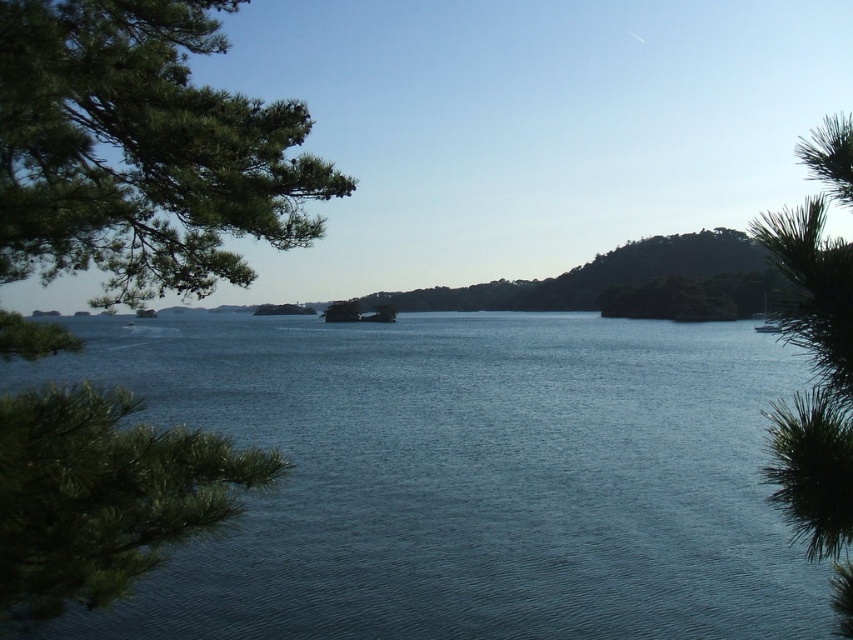
Question: Which object is positioned farthest from the blue water at center?

Choices:
 (A) green needle-like leaves at right
 (B) green matte tree at left
 (C) white glossy boat at center

Answer: (C)

Question: Which of the following is the farthest from the observer?

Choices:
 (A) (810, 448)
 (B) (270, 416)

Answer: (B)

Question: Which of the following is the farthest from the observer?

Choices:
 (A) (763, 470)
 (B) (498, 321)
 (C) (184, 77)

Answer: (B)

Question: Is green needle-like leaves at right above white glossy boat at center?

Choices:
 (A) yes
 (B) no

Answer: (A)

Question: Is green matte tree at left in front of green needle-like leaves at right?

Choices:
 (A) no
 (B) yes

Answer: (A)

Question: Considering the relative positions of green needle-like leaves at right and white glossy boat at center in the image provided, where is green needle-like leaves at right located with respect to white glossy boat at center?

Choices:
 (A) left
 (B) right

Answer: (B)